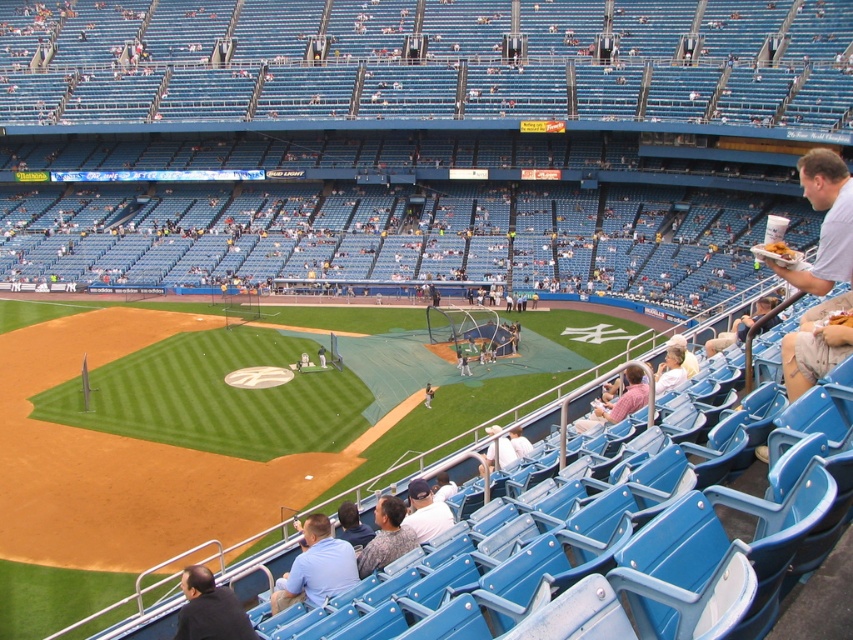
You are a photographer at the baseball stadium and want to capture both the blue fabric shirt at lower center and the camouflage shirt at lower center in the same frame. Which shirt should you focus on first to ensure both are in the shot, considering their sizes?

The blue fabric shirt at lower center is larger in size compared to the camouflage shirt at lower center, so focusing on the blue fabric shirt at lower center first will help ensure both shirts are captured in the frame.

You are a spectator at the baseball stadium and want to buy a snack from the person with the tray. You see both the blue fabric shirt at lower center and the camouflage shirt at lower center. Which shirt is closer to you?

The blue fabric shirt at lower center is closer to you because it is further to the viewer than the camouflage shirt at lower center.

You are a spectator at the baseball stadium and want to buy a snack. You see a person in a blue fabric shirt at lower center and a person in a camouflage shirt at lower center. Which person is closer to your left side?

The blue fabric shirt at lower center is to the left of camouflage shirt at lower center, so the person in the blue fabric shirt at lower center is closer to your left side.